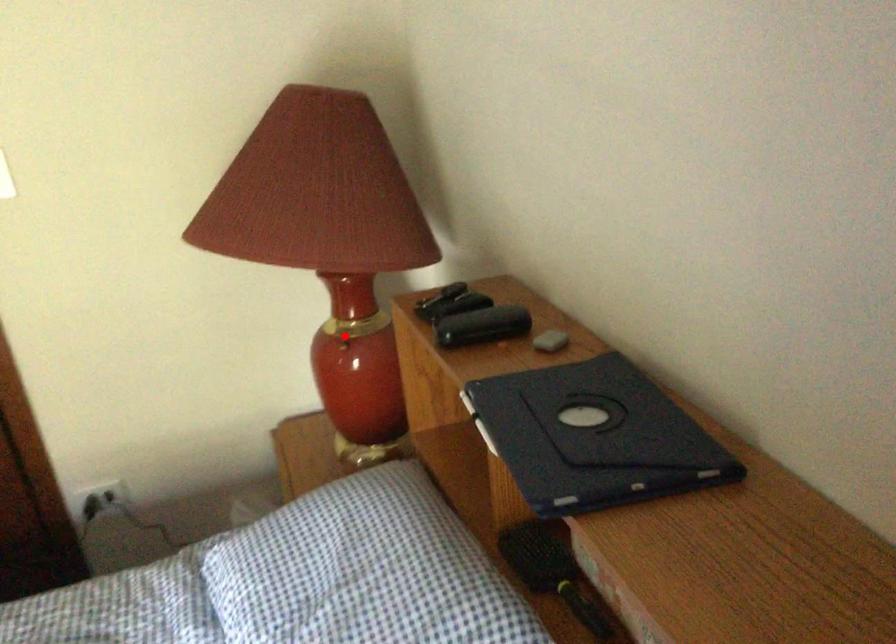
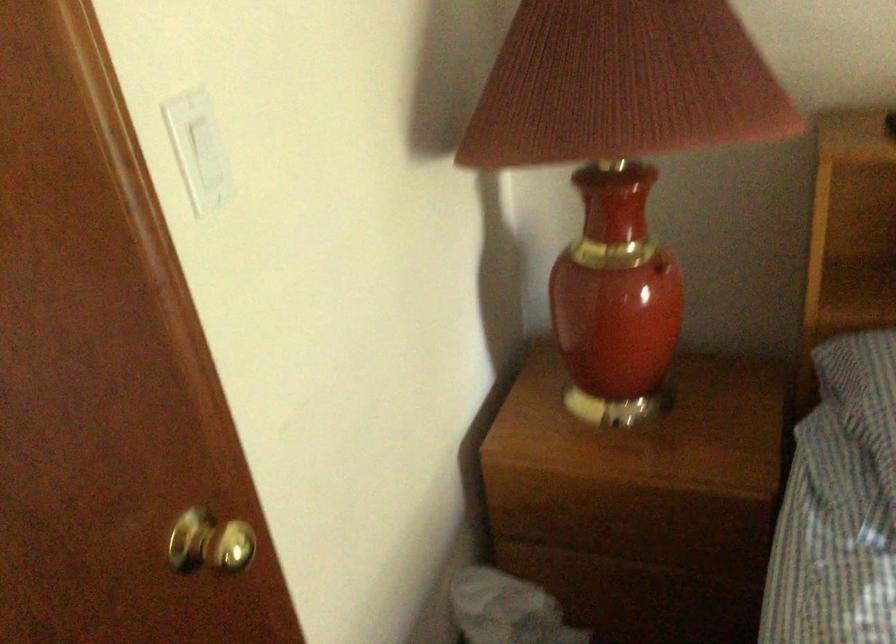
Find the pixel in the second image that matches the highlighted location in the first image.

(661, 267)